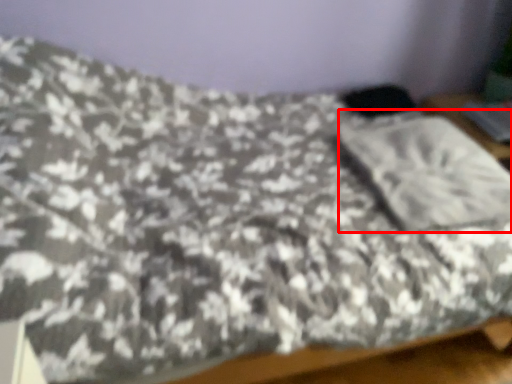
Question: Observing the image, what is the correct spatial positioning of pillow (annotated by the red box) in reference to silver?

Choices:
 (A) right
 (B) left

Answer: (B)